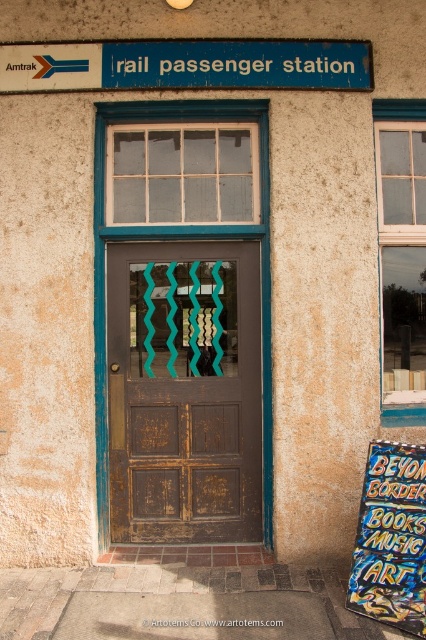
Looking at this image, you are a delivery person with a cart that is 1.8 meters wide. You need to pass through the entrance to deliver packages. Is there enough space between the brown wooden door at center and the blue painted metal signboard at upper center for your cart to fit through?

The brown wooden door at center is 1.76 meters from the blue painted metal signboard at upper center. Since your cart is 1.8 meters wide, it is slightly wider than the available space. Therefore, the cart cannot fit through the entrance between the brown wooden door at center and the blue painted metal signboard at upper center.